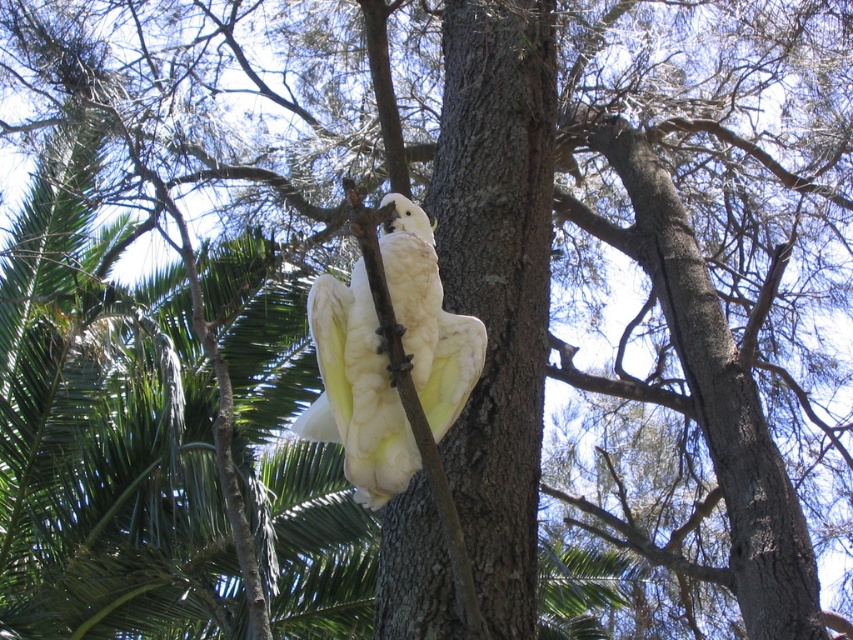
Question: Is brown rough tree trunk at center thinner than white feathered parrot at center?

Choices:
 (A) yes
 (B) no

Answer: (B)

Question: Can you confirm if brown rough tree trunk at center is wider than white feathered parrot at center?

Choices:
 (A) no
 (B) yes

Answer: (B)

Question: Is brown rough tree trunk at center bigger than white feathered parrot at center?

Choices:
 (A) yes
 (B) no

Answer: (A)

Question: Which point is closer to the camera?

Choices:
 (A) brown rough tree trunk at center
 (B) white feathered parrot at center

Answer: (B)